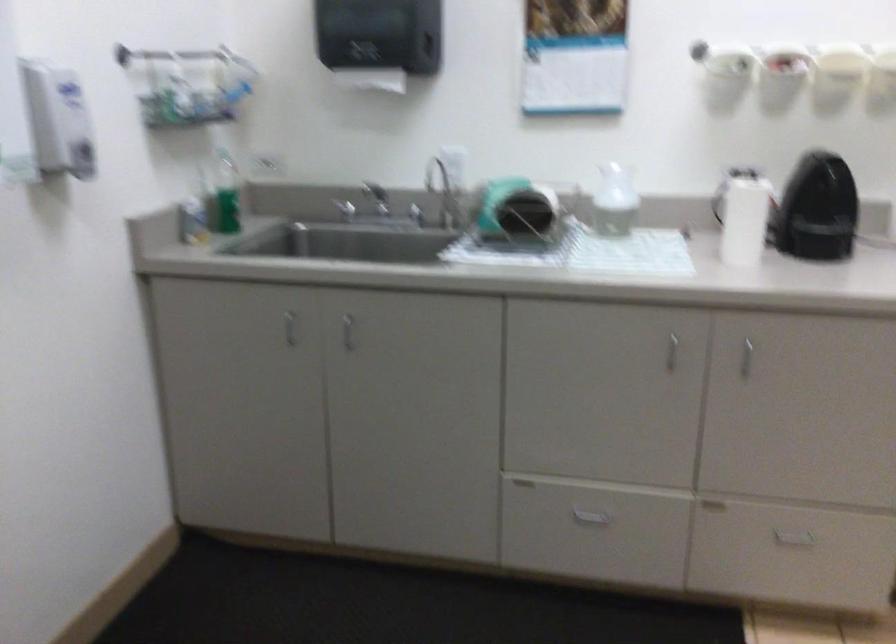
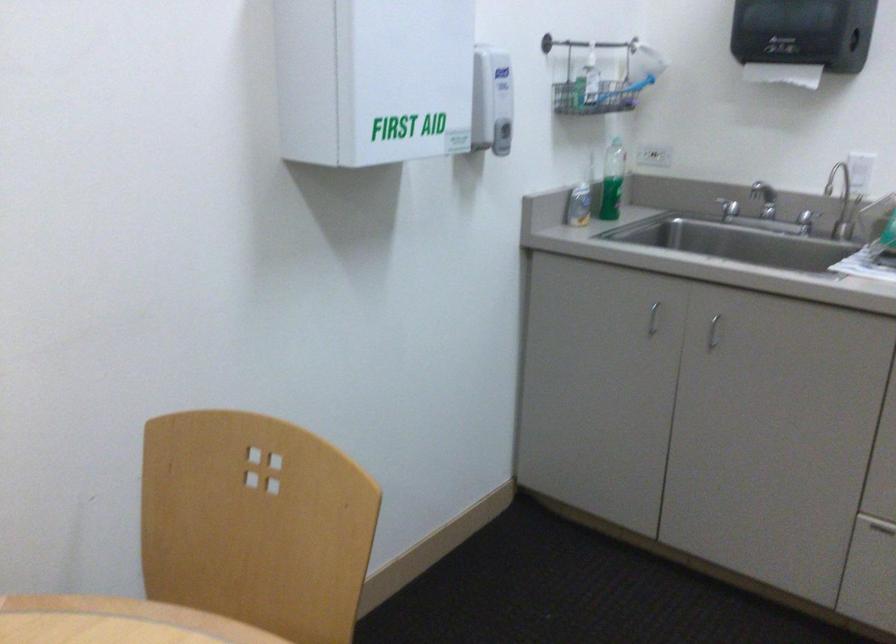
Find the pixel in the second image that matches [73,118] in the first image.

(492, 100)